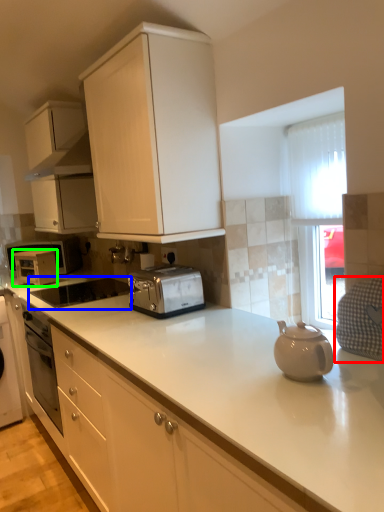
Question: Based on their relative distances, which object is nearer to gray (highlighted by a red box)? Choose from appliance (highlighted by a blue box) and appliance (highlighted by a green box).

Choices:
 (A) appliance
 (B) appliance

Answer: (A)